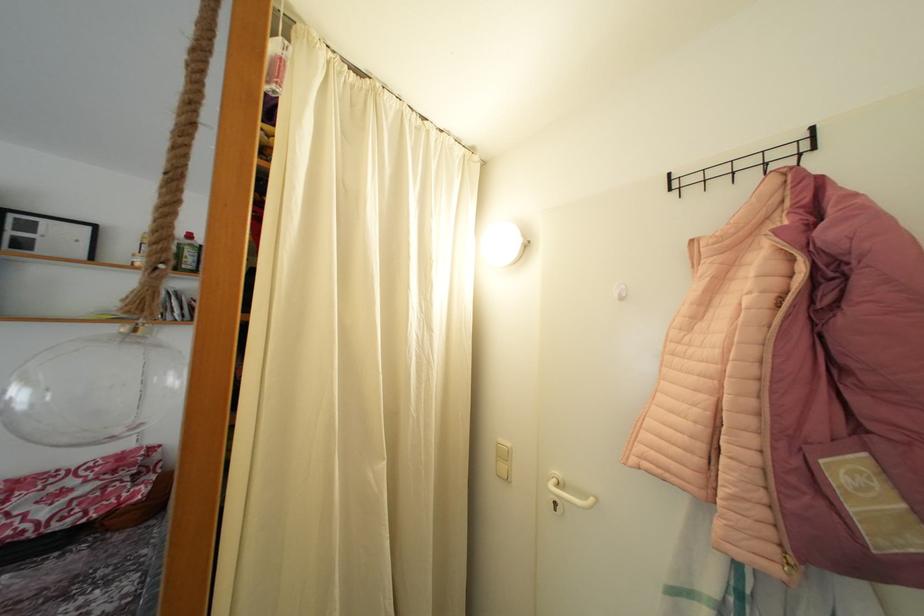
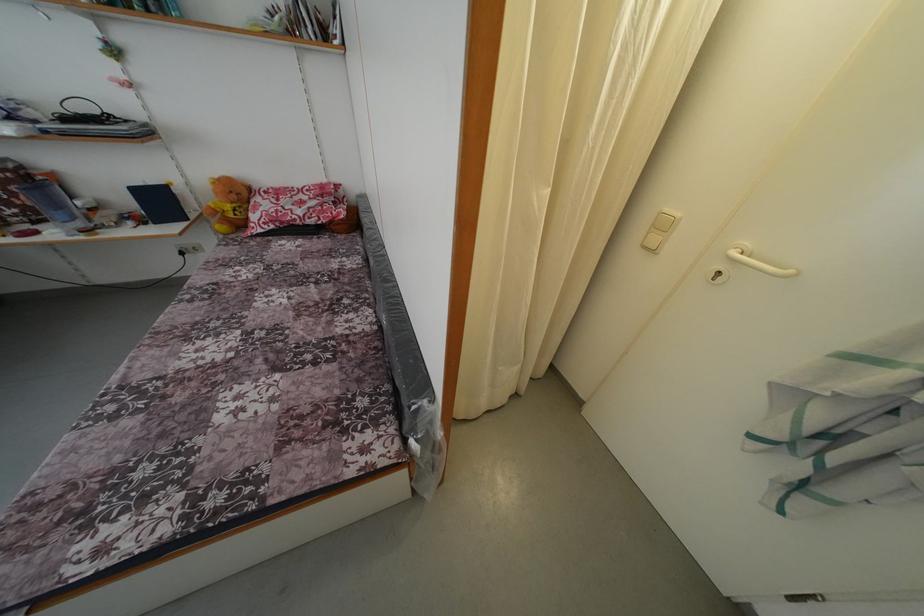
The images are taken continuously from a first-person perspective. In which direction is your viewpoint rotating?

The camera rotated toward left-down.